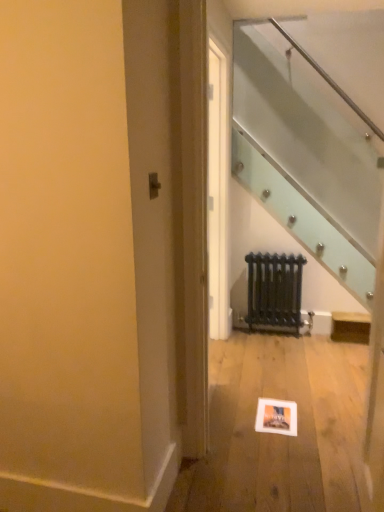
In order to click on free spot to the right of matte orange picture frame at lower center in this screenshot , I will do `click(315, 411)`.